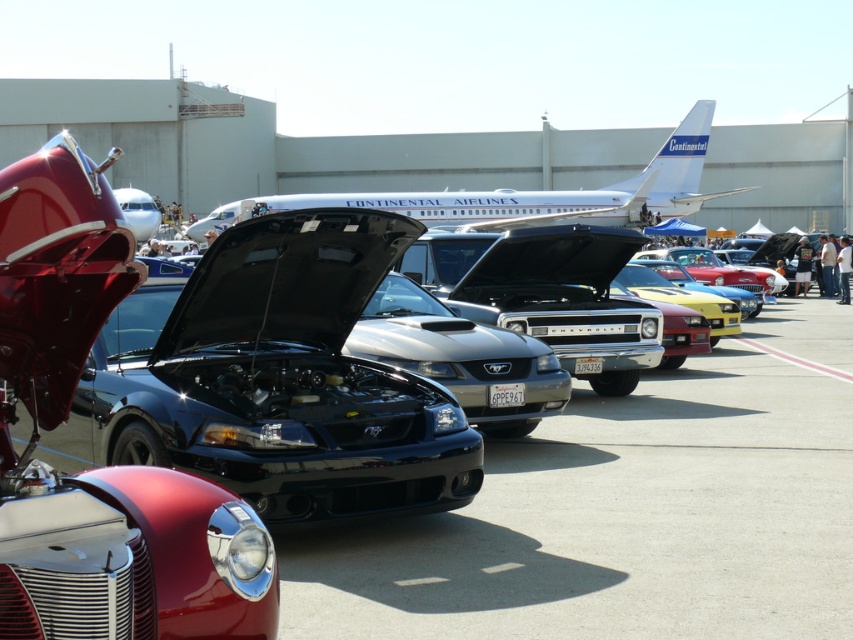
Which is behind, point (49, 323) or point (289, 209)?

The point (289, 209) is more distant.

Where is `shiny chrome car at left`? The height and width of the screenshot is (640, 853). shiny chrome car at left is located at coordinates (100, 467).